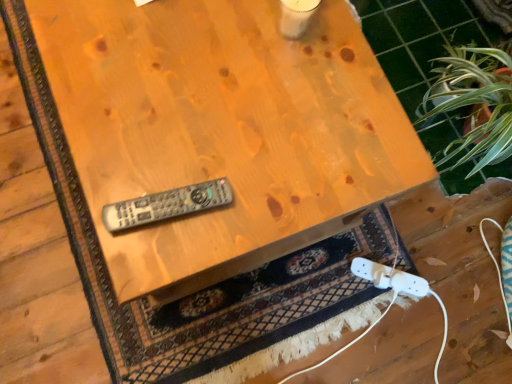
The width and height of the screenshot is (512, 384). What do you see at coordinates (419, 39) in the screenshot? I see `wooden table at upper right` at bounding box center [419, 39].

Image resolution: width=512 pixels, height=384 pixels. What do you see at coordinates (476, 104) in the screenshot?
I see `green leafy plant at upper right` at bounding box center [476, 104].

Describe the element at coordinates (222, 129) in the screenshot. The height and width of the screenshot is (384, 512). I see `wooden remote control at center` at that location.

Find the location of a particular element. The height and width of the screenshot is (384, 512). gray plastic remote at center is located at coordinates (166, 205).

I want to click on wooden table at upper right, so click(x=419, y=39).

Is point (175, 4) farther from camera compared to point (452, 96)?

That is False.

Looking at this image, considering the sizes of wooden remote control at center and green leafy plant at upper right in the image, is wooden remote control at center bigger or smaller than green leafy plant at upper right?

In the image, wooden remote control at center appears to be larger than green leafy plant at upper right.

Is wooden remote control at center not near green leafy plant at upper right?

No, wooden remote control at center is not far away from green leafy plant at upper right.

Is white plastic game controller at lower right to the left of green leafy plant at upper right from the viewer's perspective?

Correct, you'll find white plastic game controller at lower right to the left of green leafy plant at upper right.

Which object is more forward, white plastic game controller at lower right or green leafy plant at upper right?

green leafy plant at upper right is in front.

In the image, there is a green leafy plant at upper right. Where is `game controller below it (from the image's perspective)`? This screenshot has height=384, width=512. game controller below it (from the image's perspective) is located at coordinates (390, 278).

Based on the photo, is white plastic game controller at lower right next to green leafy plant at upper right and touching it?

No, white plastic game controller at lower right is not in contact with green leafy plant at upper right.

From the image's perspective, is white plastic game controller at lower right positioned above or below wooden table at upper right?

white plastic game controller at lower right is below wooden table at upper right.

Is white plastic game controller at lower right with wooden table at upper right?

No, white plastic game controller at lower right is not next to wooden table at upper right.

Is wooden table at upper right located within white plastic game controller at lower right?

Definitely not — wooden table at upper right is not inside white plastic game controller at lower right.

Who is smaller, white plastic game controller at lower right or wooden table at upper right?

With smaller size is white plastic game controller at lower right.

From a real-world perspective, who is located higher, gray plastic remote at center or wooden table at upper right?

In real-world perspective, gray plastic remote at center is above.

How much distance is there between gray plastic remote at center and wooden table at upper right?

gray plastic remote at center is 3.51 feet away from wooden table at upper right.

The image size is (512, 384). In the image, there is a gray plastic remote at center. In order to click on tile below it (from a real-world perspective) in this screenshot , I will do `click(419, 39)`.

Is gray plastic remote at center wider than wooden table at upper right?

Incorrect, the width of gray plastic remote at center does not surpass that of wooden table at upper right.

Consider the image. Which point is more distant from viewer, (x=408, y=38) or (x=150, y=215)?

The point (x=408, y=38) is more distant.

Is wooden table at upper right next to gray plastic remote at center and touching it?

There is a gap between wooden table at upper right and gray plastic remote at center.

Considering the relative sizes of wooden table at upper right and gray plastic remote at center in the image provided, is wooden table at upper right smaller than gray plastic remote at center?

No.

From the image's perspective, is wooden table at upper right on top of gray plastic remote at center?

Yes, from the image's perspective, wooden table at upper right is above gray plastic remote at center.

Is green leafy plant at upper right directly adjacent to white plastic game controller at lower right?

There is a gap between green leafy plant at upper right and white plastic game controller at lower right.

Which object is further away from the camera, green leafy plant at upper right or white plastic game controller at lower right?

white plastic game controller at lower right is further away from the camera.

Can you confirm if green leafy plant at upper right is thinner than white plastic game controller at lower right?

Yes, green leafy plant at upper right is thinner than white plastic game controller at lower right.

From the image's perspective, which object appears higher, green leafy plant at upper right or white plastic game controller at lower right?

green leafy plant at upper right is shown above in the image.

Who is bigger, green leafy plant at upper right or wooden table at upper right?

Bigger between the two is wooden table at upper right.

Which is more to the left, green leafy plant at upper right or wooden table at upper right?

From the viewer's perspective, green leafy plant at upper right appears more on the left side.

Between point (511, 155) and point (417, 76), which one is positioned in front?

The point (511, 155) is more forward.

From a real-world perspective, does green leafy plant at upper right stand above wooden table at upper right?

Yes, from a real-world perspective, green leafy plant at upper right is over wooden table at upper right

Locate an element on the screen. table below the green leafy plant at upper right (from the image's perspective) is located at coordinates (222, 129).

I want to click on game controller on the left of green leafy plant at upper right, so click(x=390, y=278).

Based on their spatial positions, is white plastic game controller at lower right or wooden table at upper right further from wooden remote control at center?

Among the two, wooden table at upper right is located further to wooden remote control at center.

Looking at this image, which object lies further to the anchor point gray plastic remote at center, wooden remote control at center or green leafy plant at upper right?

The object further to gray plastic remote at center is green leafy plant at upper right.

When comparing their distances from green leafy plant at upper right, does wooden table at upper right or white plastic game controller at lower right seem closer?

wooden table at upper right is closer to green leafy plant at upper right.

Based on their spatial positions, is wooden table at upper right or gray plastic remote at center closer to green leafy plant at upper right?

wooden table at upper right is closer to green leafy plant at upper right.

Based on their spatial positions, is green leafy plant at upper right or wooden table at upper right further from gray plastic remote at center?

wooden table at upper right lies further to gray plastic remote at center than the other object.

When comparing their distances from green leafy plant at upper right, does white plastic game controller at lower right or wooden table at upper right seem closer?

wooden table at upper right is closer to green leafy plant at upper right.

From the image, which object appears to be farther from gray plastic remote at center, green leafy plant at upper right or white plastic game controller at lower right?

Based on the image, green leafy plant at upper right appears to be further to gray plastic remote at center.

Based on their spatial positions, is wooden table at upper right or gray plastic remote at center closer to wooden remote control at center?

gray plastic remote at center.

I want to click on houseplant between gray plastic remote at center and wooden table at upper right from left to right, so click(476, 104).

Where is `table situated between gray plastic remote at center and wooden table at upper right from left to right`? This screenshot has height=384, width=512. table situated between gray plastic remote at center and wooden table at upper right from left to right is located at coordinates (222, 129).

Where is `game controller located between gray plastic remote at center and wooden table at upper right in the left-right direction`? game controller located between gray plastic remote at center and wooden table at upper right in the left-right direction is located at coordinates (390, 278).

Identify the location of houseplant between wooden table at upper right and white plastic game controller at lower right from top to bottom. This screenshot has width=512, height=384. (476, 104).